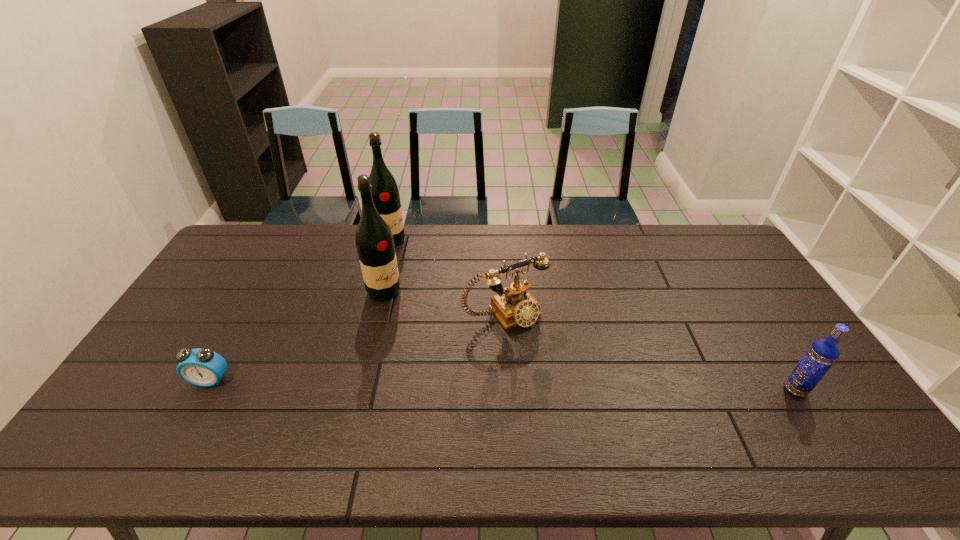
Where is `free spot located 0.270m on the front-facing side of the nearer liquor`? The width and height of the screenshot is (960, 540). free spot located 0.270m on the front-facing side of the nearer liquor is located at coordinates (462, 336).

This screenshot has width=960, height=540. In order to click on free space located 0.370m on the front-facing side of the nearer liquor in this screenshot , I will do `click(489, 352)`.

At what (x,y) coordinates should I click in order to perform the action: click on blank space located on the dial number of the second object from right to left. Please return your answer as a coordinate pair (x, y). Looking at the image, I should click on (559, 371).

Find the location of a particular element. The height and width of the screenshot is (540, 960). free space located on the dial number of the second object from right to left is located at coordinates pyautogui.click(x=548, y=358).

Where is `vacant space positioned 0.090m on the dial number of the second object from right to left`? vacant space positioned 0.090m on the dial number of the second object from right to left is located at coordinates (542, 351).

Locate an element on the screen. This screenshot has width=960, height=540. free space located 0.340m on the front-facing side of the farther liquor is located at coordinates (441, 302).

This screenshot has height=540, width=960. In order to click on free space located 0.170m on the front-facing side of the farther liquor in this screenshot , I will do `click(418, 273)`.

Identify the location of vacant region located on the front-facing side of the farther liquor. (445, 307).

Where is `object present at the far edge`? object present at the far edge is located at coordinates (385, 194).

Identify the location of object at the near edge. Image resolution: width=960 pixels, height=540 pixels. (822, 354).